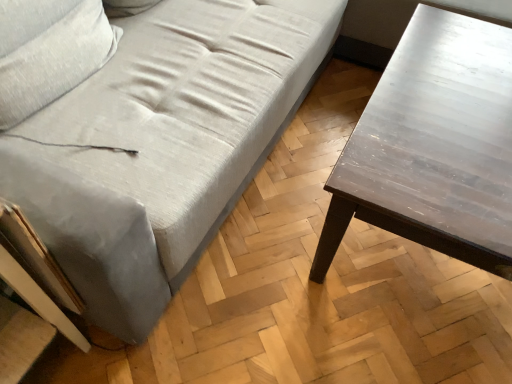
Find the location of a particular element. light gray fabric couch at center is located at coordinates point(162,144).

The height and width of the screenshot is (384, 512). Describe the element at coordinates (162, 144) in the screenshot. I see `light gray fabric couch at center` at that location.

Describe the element at coordinates (433, 146) in the screenshot. I see `dark brown wooden table at right` at that location.

You are a GUI agent. You are given a task and a screenshot of the screen. Output one action in this format:
    pyautogui.click(x=<x>, y=<y>)
    Task: Click on the dark brown wooden table at right
    
    Given the screenshot: What is the action you would take?
    pyautogui.click(x=433, y=146)

What is the approximate width of dark brown wooden table at right?

dark brown wooden table at right is 26.21 inches wide.

Find the location of a particular element. This screenshot has width=512, height=384. light gray fabric couch at center is located at coordinates (162, 144).

Is dark brown wooden table at right to the left of light gray fabric couch at center from the viewer's perspective?

No.

Relative to light gray fabric couch at center, is dark brown wooden table at right in front or behind?

Visually, dark brown wooden table at right is located behind light gray fabric couch at center.

Is point (345, 209) more distant than point (133, 79)?

That is False.

From the image's perspective, is dark brown wooden table at right over light gray fabric couch at center?

No, from the image's perspective, dark brown wooden table at right is not above light gray fabric couch at center.

In the scene shown: From a real-world perspective, which object rests below the other?

dark brown wooden table at right is physically lower.

Can you confirm if dark brown wooden table at right is thinner than light gray fabric couch at center?

Yes.

Considering the relative sizes of dark brown wooden table at right and light gray fabric couch at center in the image provided, is dark brown wooden table at right shorter than light gray fabric couch at center?

Correct, dark brown wooden table at right is not as tall as light gray fabric couch at center.

Considering the relative sizes of dark brown wooden table at right and light gray fabric couch at center in the image provided, is dark brown wooden table at right bigger than light gray fabric couch at center?

No, dark brown wooden table at right is not bigger than light gray fabric couch at center.

Is dark brown wooden table at right not within light gray fabric couch at center?

No, most part of dark brown wooden table at right lies within light gray fabric couch at center.

Is dark brown wooden table at right far away from light gray fabric couch at center?

Actually, dark brown wooden table at right and light gray fabric couch at center are a little close together.

Is dark brown wooden table at right turned away from light gray fabric couch at center?

Yes, dark brown wooden table at right is positioned with its back facing light gray fabric couch at center.

Identify the location of studio couch above the dark brown wooden table at right (from the image's perspective). (162, 144).

Considering the positions of objects light gray fabric couch at center and dark brown wooden table at right in the image provided, who is more to the left, light gray fabric couch at center or dark brown wooden table at right?

Positioned to the left is light gray fabric couch at center.

Considering the positions of objects light gray fabric couch at center and dark brown wooden table at right in the image provided, who is in front, light gray fabric couch at center or dark brown wooden table at right?

light gray fabric couch at center is closer to the camera.

Is point (26, 152) positioned in front of point (502, 135)?

Yes, it is.

From the image's perspective, is light gray fabric couch at center above dark brown wooden table at right?

Yes, from the image's perspective, light gray fabric couch at center is above dark brown wooden table at right.

From a real-world perspective, which is physically above, light gray fabric couch at center or dark brown wooden table at right?

light gray fabric couch at center is physically above.

Does light gray fabric couch at center have a lesser width compared to dark brown wooden table at right?

No, light gray fabric couch at center is not thinner than dark brown wooden table at right.

Does light gray fabric couch at center have a lesser height compared to dark brown wooden table at right?

No.

Is light gray fabric couch at center bigger than dark brown wooden table at right?

Indeed, light gray fabric couch at center has a larger size compared to dark brown wooden table at right.

Could dark brown wooden table at right be considered to be inside light gray fabric couch at center?

Yes, dark brown wooden table at right is inside light gray fabric couch at center.

Is light gray fabric couch at center next to dark brown wooden table at right and touching it?

light gray fabric couch at center and dark brown wooden table at right are clearly separated.

Is light gray fabric couch at center facing away from dark brown wooden table at right?

No.

What are the coordinates of `table located on the right of light gray fabric couch at center` in the screenshot? It's located at (433, 146).

Where is `studio couch that is on the left side of dark brown wooden table at right`? The image size is (512, 384). studio couch that is on the left side of dark brown wooden table at right is located at coordinates (162, 144).

Image resolution: width=512 pixels, height=384 pixels. Identify the location of studio couch above the dark brown wooden table at right (from a real-world perspective). (162, 144).